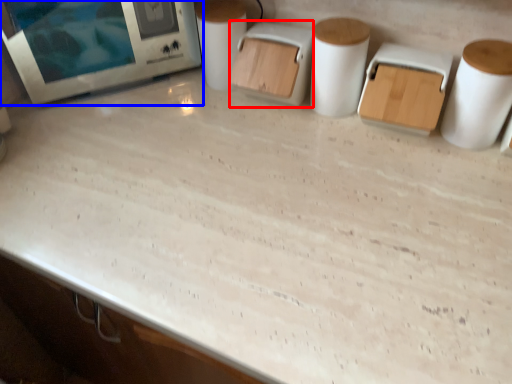
Question: Which object is further to the camera taking this photo, appliance (highlighted by a red box) or home appliance (highlighted by a blue box)?

Choices:
 (A) appliance
 (B) home appliance

Answer: (B)